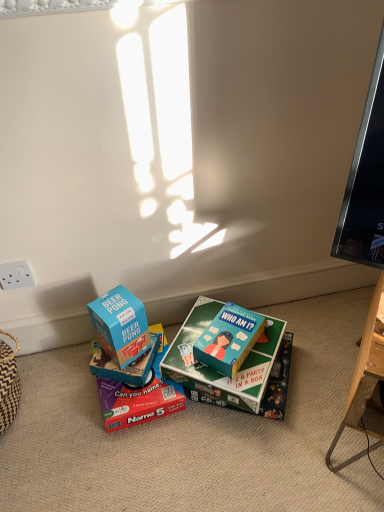
Question: From a real-world perspective, is teal matte board game at center, which is counted as the 1th box, starting from the right, positioned above or below matte cardboard box at center, the 3th box positioned from the left?

Choices:
 (A) above
 (B) below

Answer: (A)

Question: Would you say teal matte board game at center, which is counted as the 1th box, starting from the right, is to the left or to the right of matte cardboard box at center, the 3th box positioned from the left, in the picture?

Choices:
 (A) right
 (B) left

Answer: (A)

Question: Which object is the farthest from the teal matte board game at center, which is the 5th box from left to right?

Choices:
 (A) white plastic power outlet at lower left
 (B) matte cardboard box at center, the 3th box positioned from the left
 (C) teal matte board game at center, arranged as the 4th box when viewed from the left
 (D) blue cardboard box at center, marked as the 4th box in a right-to-left arrangement
 (E) blue cardboard box at center, acting as the 5th box starting from the right

Answer: (A)

Question: Based on their relative distances, which object is nearer to the white plastic power outlet at lower left?

Choices:
 (A) teal matte board game at center, which is counted as the 1th box, starting from the right
 (B) blue cardboard box at center, the second box when ordered from left to right
 (C) blue cardboard box at center, acting as the 5th box starting from the right
 (D) matte cardboard box at center, the 3th box positioned from the left
 (E) teal matte board game at center, arranged as the 4th box when viewed from the left

Answer: (C)